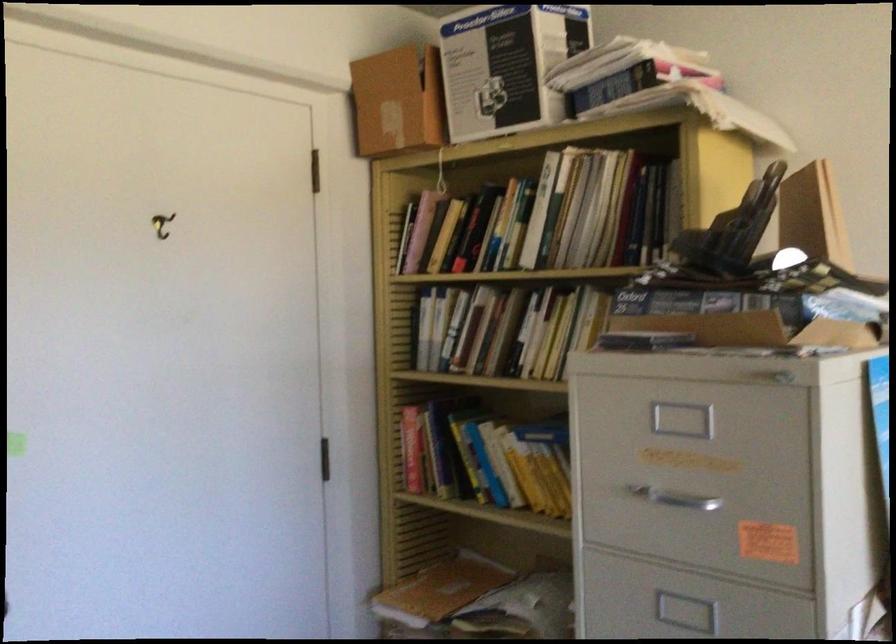
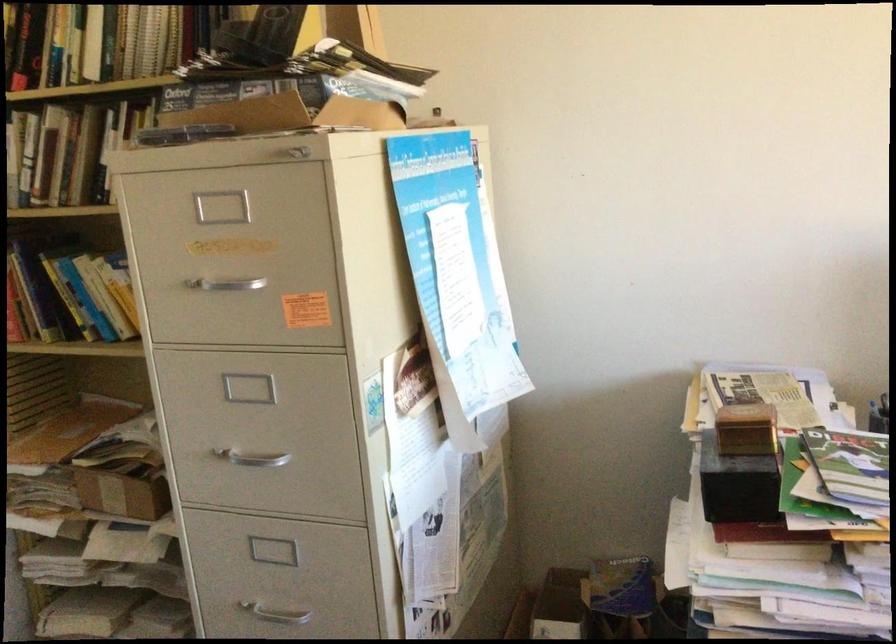
The point at (509, 238) is marked in the first image. Where is the corresponding point in the second image?

(62, 46)